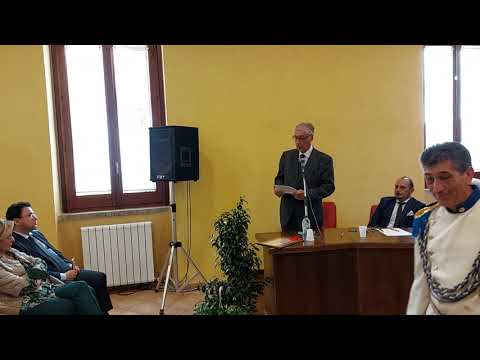
This screenshot has width=480, height=360. What are the coordinates of `stereo` in the screenshot? It's located at (x=177, y=148).